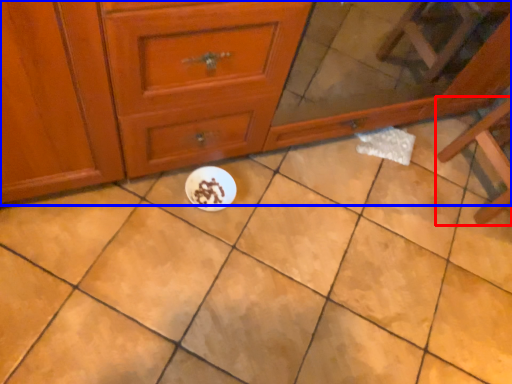
Question: Which of the following is the farthest to the observer, furniture (highlighted by a red box) or chest of drawers (highlighted by a blue box)?

Choices:
 (A) furniture
 (B) chest of drawers

Answer: (A)